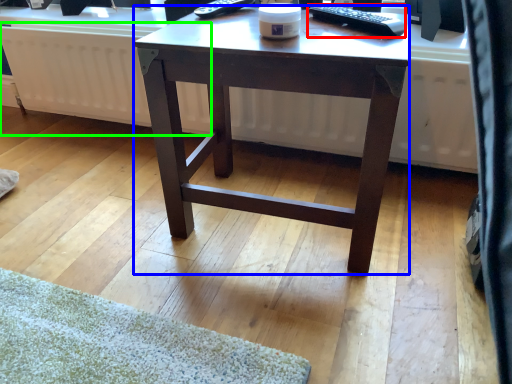
Question: Which object is positioned farthest from remote control (highlighted by a red box)? Select from desk (highlighted by a blue box) and radiator (highlighted by a green box).

Choices:
 (A) desk
 (B) radiator

Answer: (B)